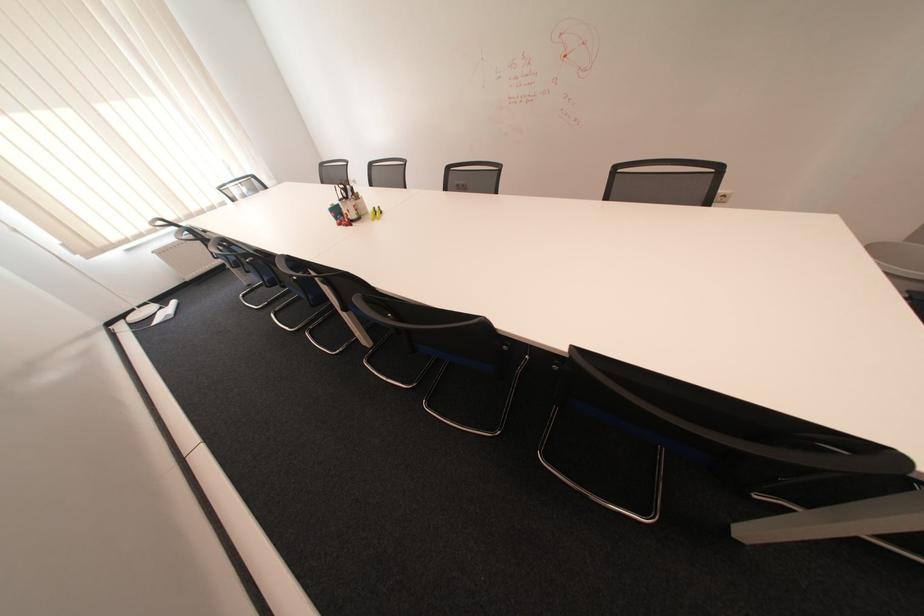
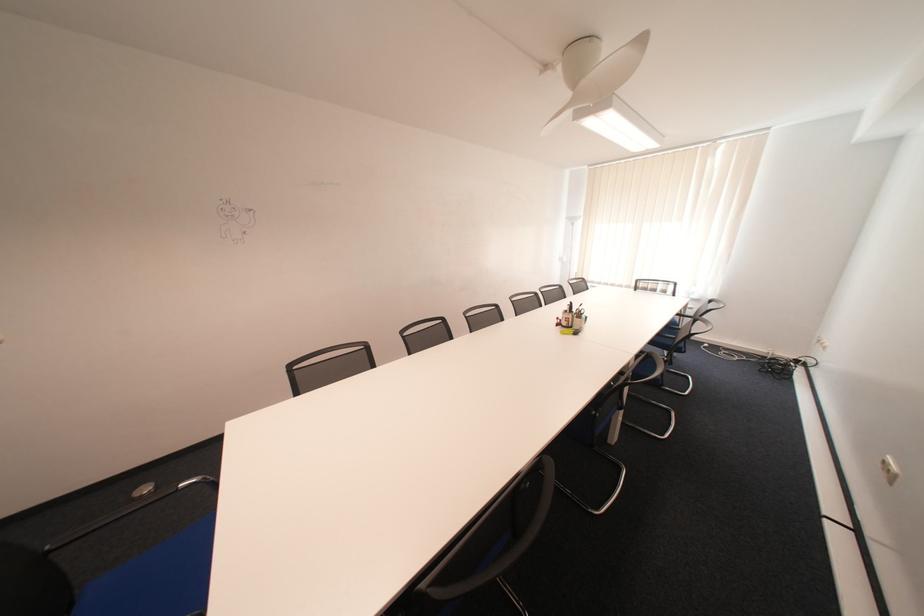
Find the pixel in the second image that matches the point at 358,199 in the first image.

(578, 312)